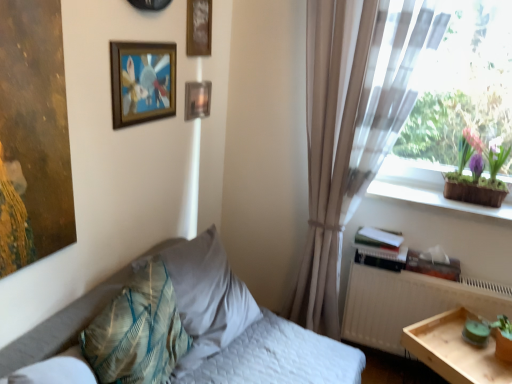
In order to click on vacant region to the left of purple clay pot at window in this screenshot , I will do `click(426, 196)`.